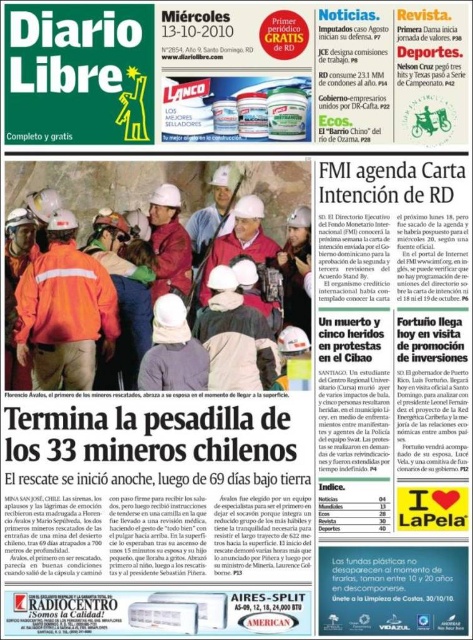
Who is lower down, orange reflective jacket at center or reddish-brown fabric hard hat at center?

orange reflective jacket at center

Can you confirm if orange reflective jacket at center is wider than reddish-brown fabric hard hat at center?

Yes, orange reflective jacket at center is wider than reddish-brown fabric hard hat at center.

Is point (268, 208) closer to viewer compared to point (166, 264)?

Yes, it is in front of point (166, 264).

Locate an element on the screen. The width and height of the screenshot is (473, 640). orange reflective jacket at center is located at coordinates (106, 184).

Is orange fabric safety vest at center positioned in front of reddish-brown fabric hard hat at center?

Yes, orange fabric safety vest at center is in front of reddish-brown fabric hard hat at center.

Is orange fabric safety vest at center wider than reddish-brown fabric hard hat at center?

Yes, orange fabric safety vest at center is wider than reddish-brown fabric hard hat at center.

Which is behind, point (108, 346) or point (183, 272)?

The point (183, 272) is behind.

What are the coordinates of `orange fabric safety vest at center` in the screenshot? It's located at 63,310.

Which is more to the left, orange reflective jacket at center or orange fabric safety vest at center?

Positioned to the left is orange fabric safety vest at center.

Who is shorter, orange reflective jacket at center or orange fabric safety vest at center?

orange fabric safety vest at center

Where is `orange reflective jacket at center`? This screenshot has width=473, height=640. orange reflective jacket at center is located at coordinates (106, 184).

Where is `orange reflective jacket at center`? The image size is (473, 640). orange reflective jacket at center is located at coordinates (106, 184).